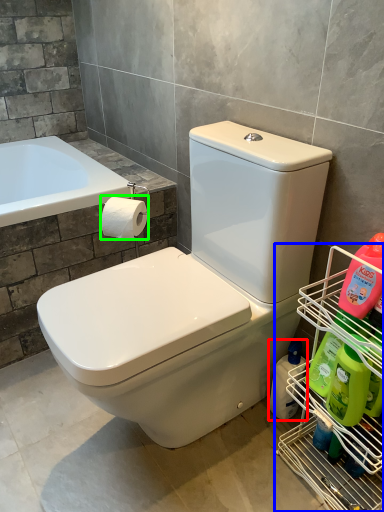
Question: Which is nearer to the cleaning product (highlighted by a red box)? shelf (highlighted by a blue box) or toilet paper (highlighted by a green box).

Choices:
 (A) shelf
 (B) toilet paper

Answer: (A)